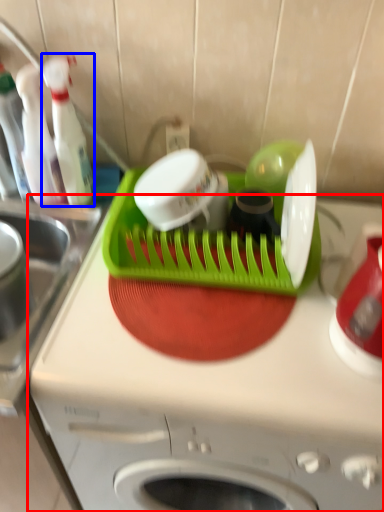
Question: Which object is further to the camera taking this photo, home appliance (highlighted by a red box) or bottle (highlighted by a blue box)?

Choices:
 (A) home appliance
 (B) bottle

Answer: (B)